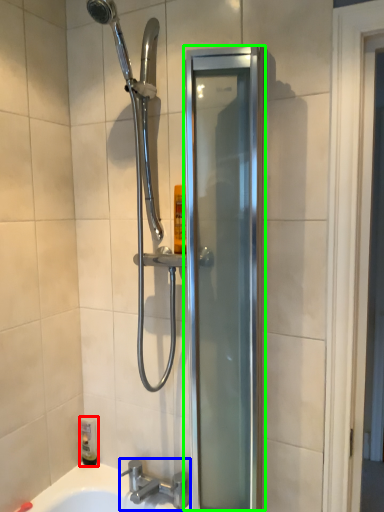
Question: Estimate the real-world distances between objects in this image. Which object is farther from toiletry (highlighted by a red box), tap (highlighted by a blue box) or screen door (highlighted by a green box)?

Choices:
 (A) tap
 (B) screen door

Answer: (B)